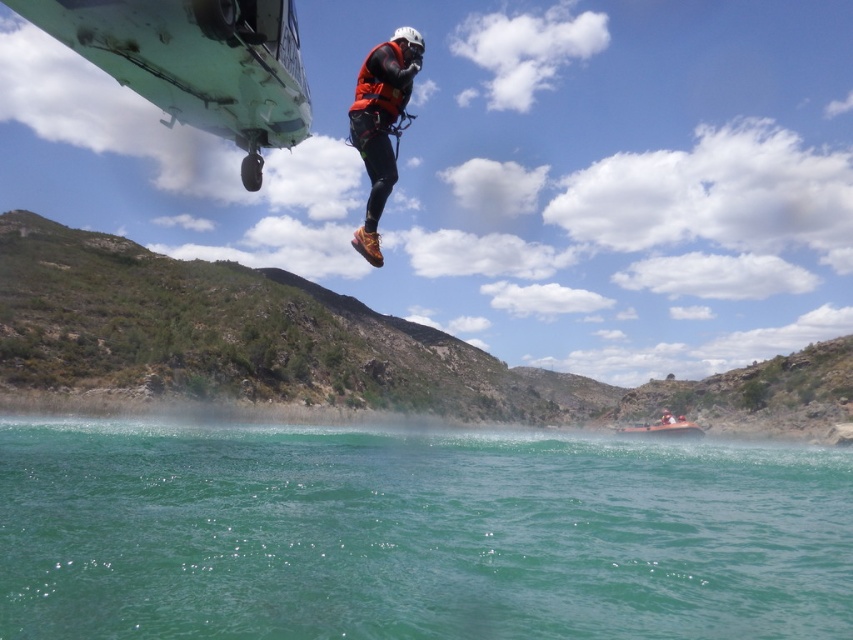
Who is more distant from viewer, (416, 531) or (666, 424)?

Positioned behind is point (666, 424).

Does point (4, 538) come closer to viewer compared to point (670, 419)?

Yes, it is in front of point (670, 419).

Which is in front, point (660, 525) or point (666, 408)?

Point (660, 525)

This screenshot has width=853, height=640. Identify the location of green smooth water at lower center. (415, 532).

Looking at this image, can you confirm if orange matte life vest at center is positioned above orange matte life jacket at center?

Correct, orange matte life vest at center is located above orange matte life jacket at center.

Who is positioned more to the right, orange matte life vest at center or orange matte life jacket at center?

From the viewer's perspective, orange matte life jacket at center appears more on the right side.

Who is more forward, (349, 109) or (395, 116)?

Positioned in front is point (395, 116).

At what (x,y) coordinates should I click in order to perform the action: click on orange matte life vest at center. Please return your answer as a coordinate pair (x, y). The width and height of the screenshot is (853, 640). Looking at the image, I should click on (381, 124).

Who is higher up, orange rubber boat at lower right or orange fabric helmet at upper center?

orange fabric helmet at upper center

This screenshot has width=853, height=640. I want to click on orange rubber boat at lower right, so click(664, 428).

This screenshot has height=640, width=853. I want to click on orange rubber boat at lower right, so click(664, 428).